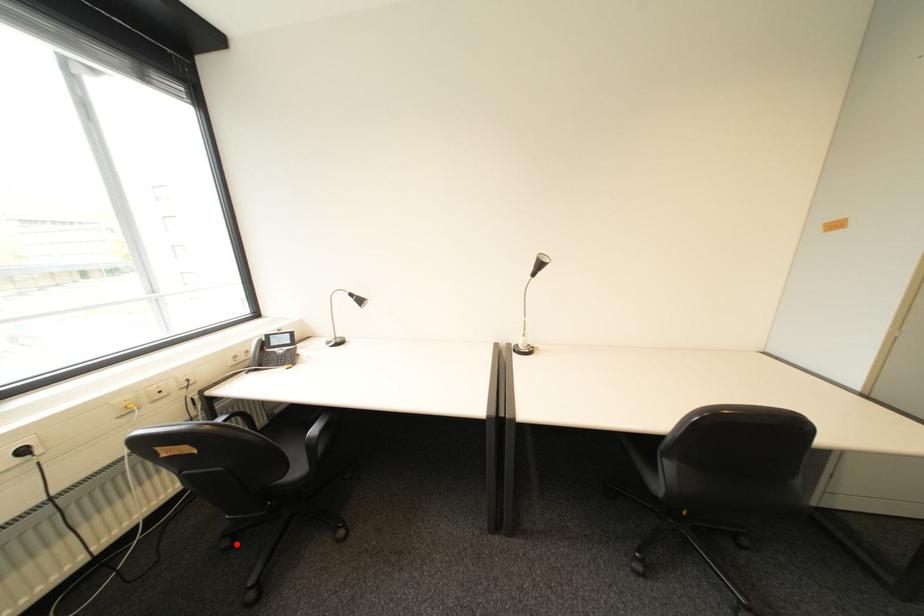
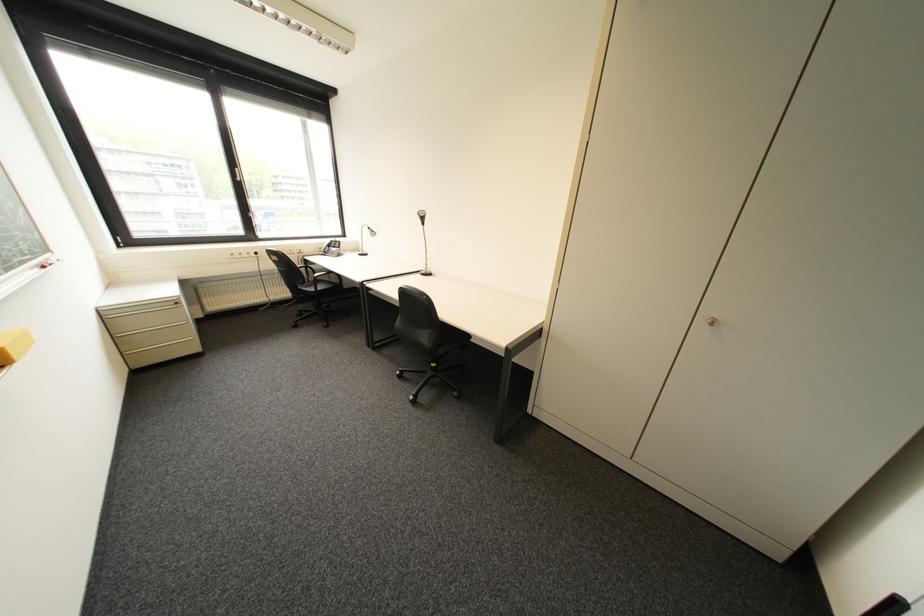
Find the pixel in the second image that matches the highlighted location in the first image.

(309, 314)